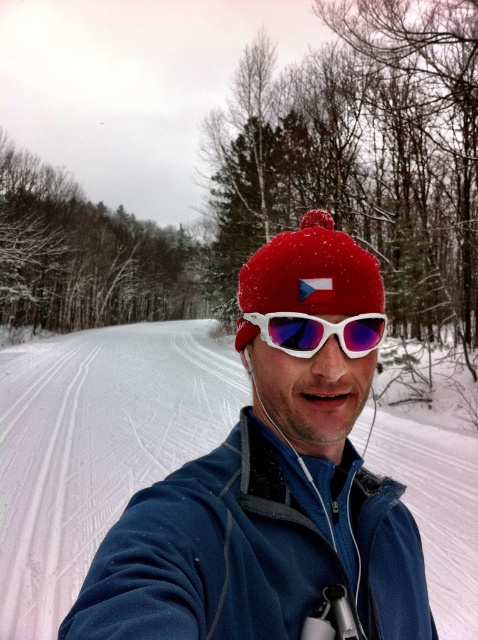
Question: Does blue fleece jacket at center have a smaller size compared to white matte/glossy goggles at center?

Choices:
 (A) yes
 (B) no

Answer: (B)

Question: Which object is farther from the camera taking this photo?

Choices:
 (A) white matte/glossy goggles at center
 (B) blue fleece jacket at center

Answer: (A)

Question: Does blue fleece jacket at center appear on the left side of red knitted hat at center?

Choices:
 (A) yes
 (B) no

Answer: (A)

Question: Which point is farther to the camera?

Choices:
 (A) white matte/glossy goggles at center
 (B) blue fleece jacket at center
 (C) red knitted hat at center

Answer: (C)

Question: Does blue fleece jacket at center have a greater width compared to white matte/glossy goggles at center?

Choices:
 (A) yes
 (B) no

Answer: (A)

Question: Which object is farther from the camera taking this photo?

Choices:
 (A) white matte/glossy goggles at center
 (B) blue fleece jacket at center
 (C) red knitted hat at center

Answer: (C)